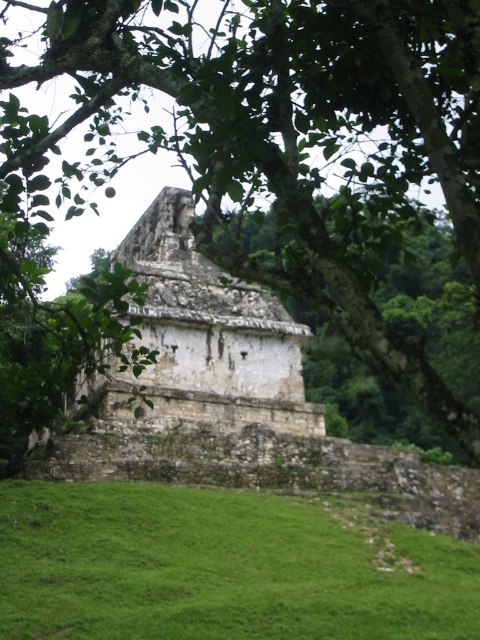
Based on the photo, you are standing on the green grassy hillside at lower center and want to reach the stone temple at center. Which direction should you move to ascend towards it?

You should move upwards towards the stone temple at center since the green grassy hillside at lower center is located below it.

You are standing at the base of the ancient stone structure and notice two elements in the scene. Which one is taller between the green leafy tree at center and the green grassy hillside at lower center?

The green leafy tree at center is taller than the green grassy hillside at lower center.